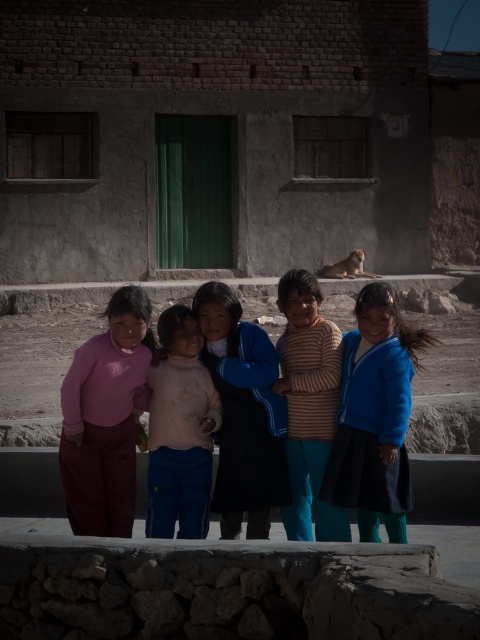
Question: Observing the image, what is the correct spatial positioning of pink matte pants at left in reference to white soft turtleneck sweater at center?

Choices:
 (A) below
 (B) above

Answer: (B)

Question: Estimate the real-world distances between objects in this image. Which object is closer to the blue matte jacket at center?

Choices:
 (A) pink matte pants at left
 (B) white soft turtleneck sweater at center
 (C) blue woolen sweater at center
 (D) striped knit sweater at center

Answer: (D)

Question: Estimate the real-world distances between objects in this image. Which object is closer to the blue matte jacket at center?

Choices:
 (A) striped knit sweater at center
 (B) white soft turtleneck sweater at center

Answer: (A)

Question: Which of the following is the closest to the observer?

Choices:
 (A) blue woolen sweater at center
 (B) striped knit sweater at center

Answer: (B)

Question: Does blue matte jacket at center appear on the left side of white soft turtleneck sweater at center?

Choices:
 (A) yes
 (B) no

Answer: (B)

Question: Can you confirm if blue woolen sweater at center is positioned above striped knit sweater at center?

Choices:
 (A) yes
 (B) no

Answer: (B)